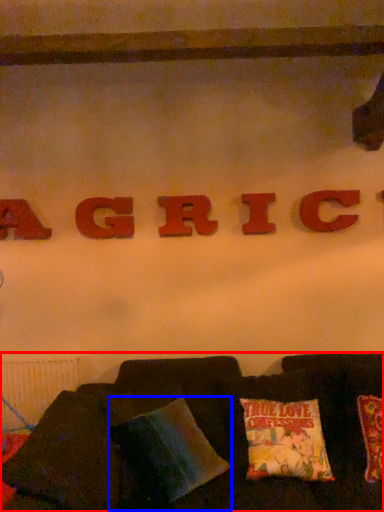
Question: Which object is further to the camera taking this photo, furniture (highlighted by a red box) or pillow (highlighted by a blue box)?

Choices:
 (A) furniture
 (B) pillow

Answer: (B)